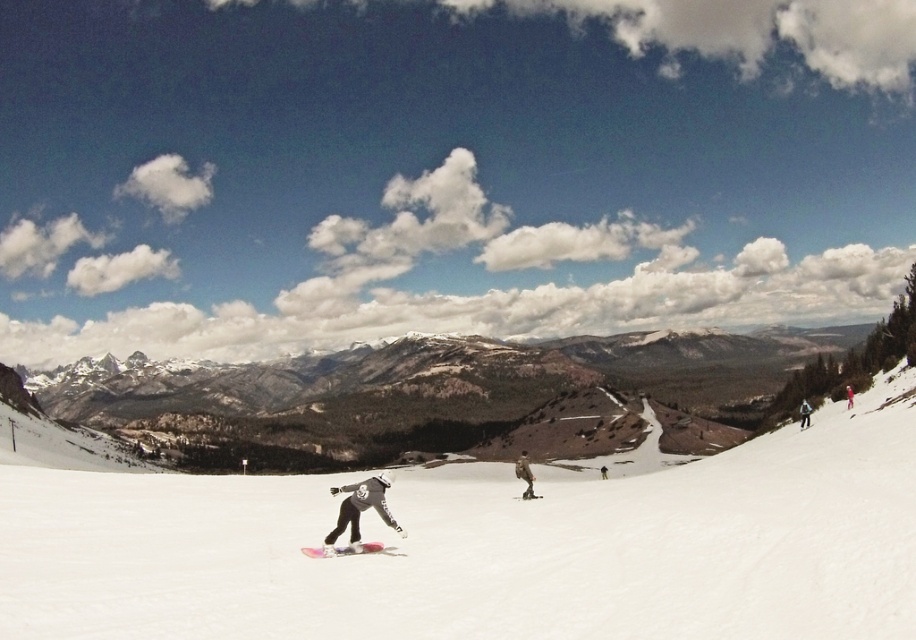
Based on the photo, does white snowboard at center have a lesser width compared to matte pink snowboard at right?

In fact, white snowboard at center might be wider than matte pink snowboard at right.

Locate an element on the screen. The width and height of the screenshot is (916, 640). white snowboard at center is located at coordinates (488, 547).

Is point (347, 545) positioned in front of point (522, 451)?

Yes, it is in front of point (522, 451).

Which is in front, point (367, 545) or point (519, 465)?

Point (367, 545)

This screenshot has width=916, height=640. In order to click on white matte snowboard at center in this screenshot , I will do `click(360, 548)`.

Does white snowboard at center have a lesser height compared to red fabric jacket at right?

In fact, white snowboard at center may be taller than red fabric jacket at right.

Between point (880, 584) and point (852, 404), which one is positioned behind?

Positioned behind is point (852, 404).

This screenshot has width=916, height=640. Find the location of `white snowboard at center`. white snowboard at center is located at coordinates (488, 547).